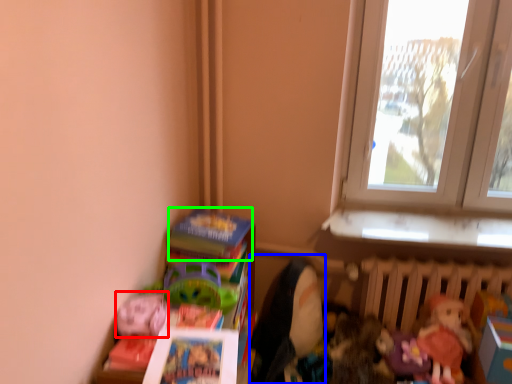
Question: Based on their relative distances, which object is farther from toy (highlighted by a red box)? Choose from doll (highlighted by a blue box) and book (highlighted by a green box).

Choices:
 (A) doll
 (B) book

Answer: (A)